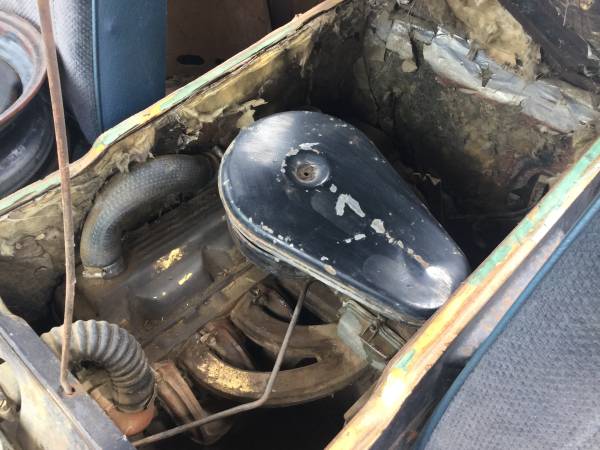
The image size is (600, 450). In order to click on cable hole in this screenshot , I will do pos(71,390).